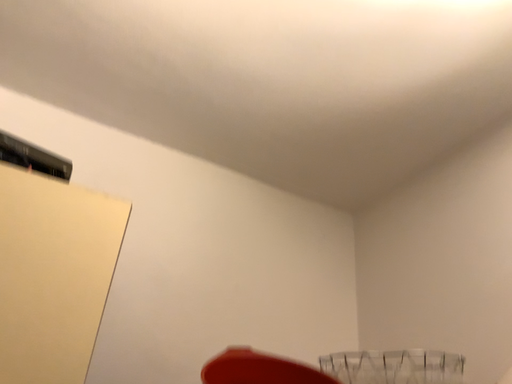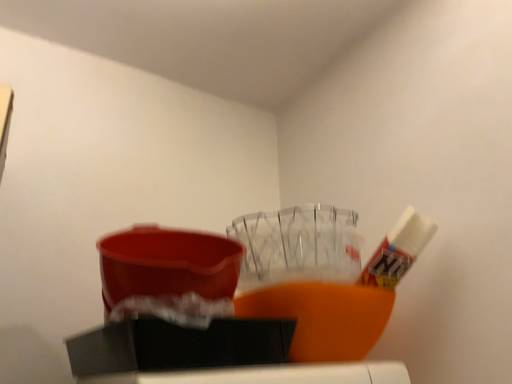
Question: Which way did the camera rotate in the video?

Choices:
 (A) rotated upward
 (B) rotated downward

Answer: (B)